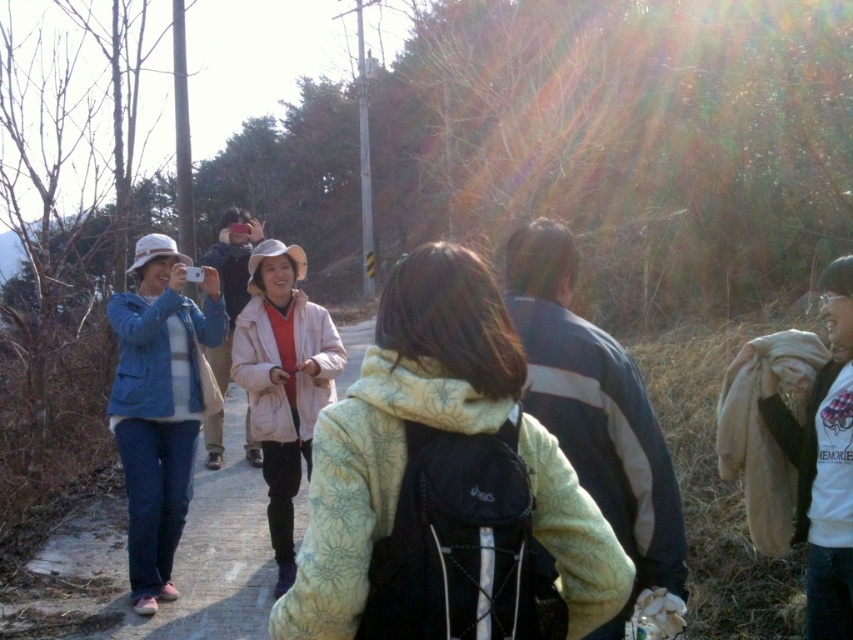
You are planning to buy a jacket for a hiking trip and are comparing the two jackets in the image. Given that the blue denim jacket at left and the matte blue jacket at left are both in the scene, which one would you choose if you want a wider jacket for better layering?

The blue denim jacket at left has a larger width than the matte blue jacket at left, making it a better choice for better layering.

In the scene shown: You are standing at the center of the image and want to find the blue denim jacket at left. In which direction should you look to locate it?

The blue denim jacket at left is located at the left side of the image, so you should look to your left to find it.